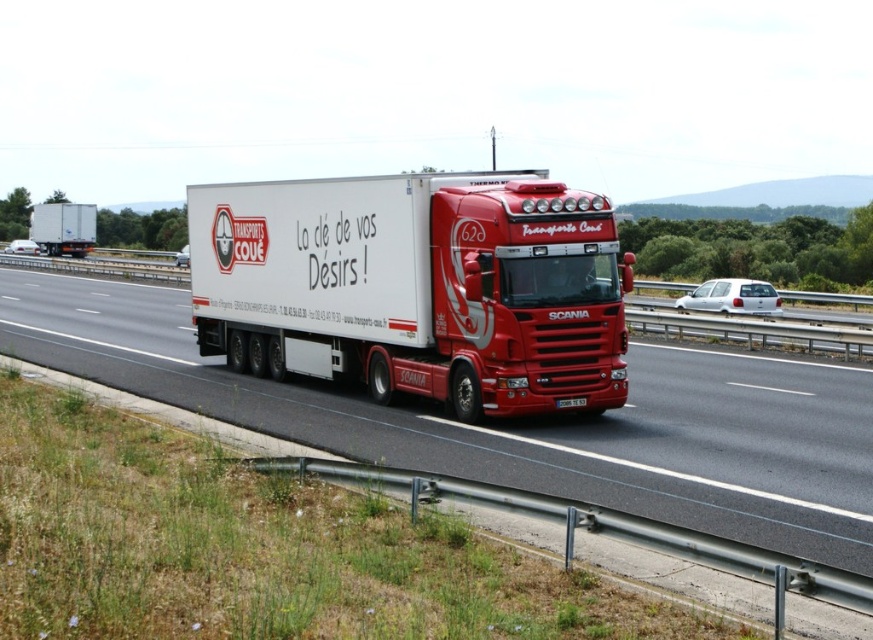
Can you confirm if white matte truck at center is positioned to the left of white glossy trailer at center?

No, white matte truck at center is not to the left of white glossy trailer at center.

Can you confirm if white matte truck at center is shorter than white glossy trailer at center?

Correct, white matte truck at center is not as tall as white glossy trailer at center.

Which is in front, point (772, 445) or point (31, 220)?

Point (772, 445)

I want to click on white matte truck at center, so click(520, 420).

Which is more to the left, white matte trailer truck at center or black plastic license plate at center?

From the viewer's perspective, white matte trailer truck at center appears more on the left side.

Does white matte trailer truck at center appear over black plastic license plate at center?

Yes, white matte trailer truck at center is above black plastic license plate at center.

Which is in front, point (464, 268) or point (569, 400)?

Point (569, 400) is more forward.

Where is `white matte trailer truck at center`? This screenshot has height=640, width=873. white matte trailer truck at center is located at coordinates (416, 285).

Can you confirm if white matte truck at center is positioned to the left of black plastic license plate at center?

Correct, you'll find white matte truck at center to the left of black plastic license plate at center.

Identify the location of white matte truck at center. Image resolution: width=873 pixels, height=640 pixels. (520, 420).

You are a GUI agent. You are given a task and a screenshot of the screen. Output one action in this format:
    pyautogui.click(x=<x>, y=<y>)
    Task: Click on the white matte truck at center
    This screenshot has width=873, height=640.
    Given the screenshot: What is the action you would take?
    pyautogui.click(x=520, y=420)